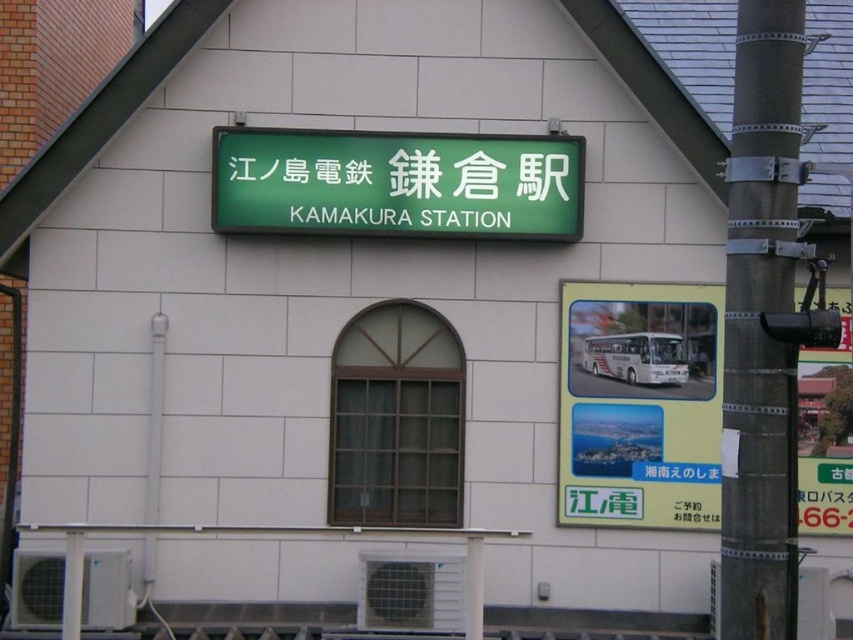
You are standing at the entrance of Kamakura Station and need to locate the green plastic signboard at center. According to the coordinates provided, where exactly should you look to find it?

The green plastic signboard at center is located at coordinates point (x=640, y=404).

You are standing at the entrance of Kamakura Station and want to take a photo of the green signboard. There are two points marked on the ground where you can stand. The first point is at coordinate point (701, 451) and the second is at point (753, 8). Which point should you choose to ensure that the green signboard is visible in your photo?

You should choose point (753, 8) because point (701, 451) is behind point (753, 8), meaning the signboard would be obstructed from the first point.